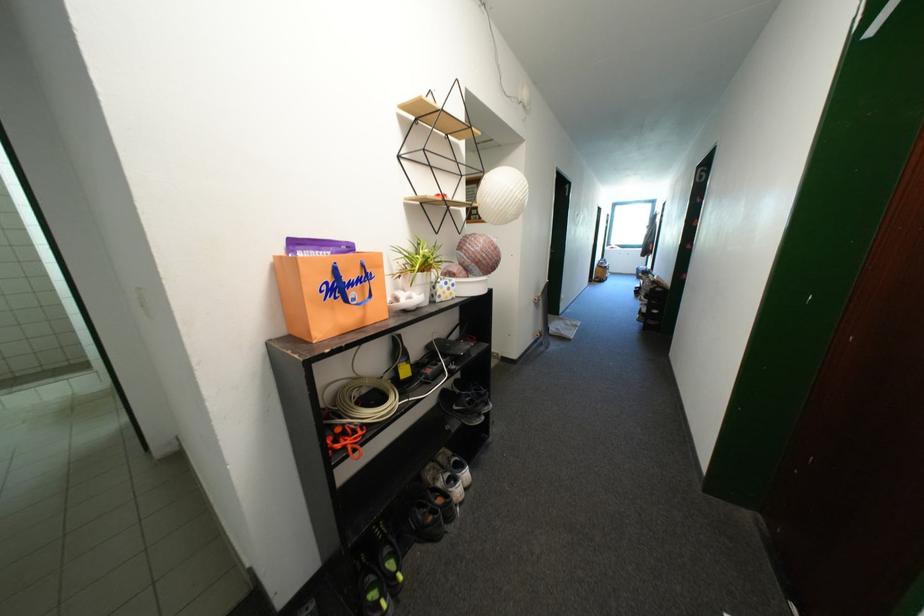
Find where to lift the white sneaker. Please return your answer as a coordinate pair (x, y).

(444, 480)